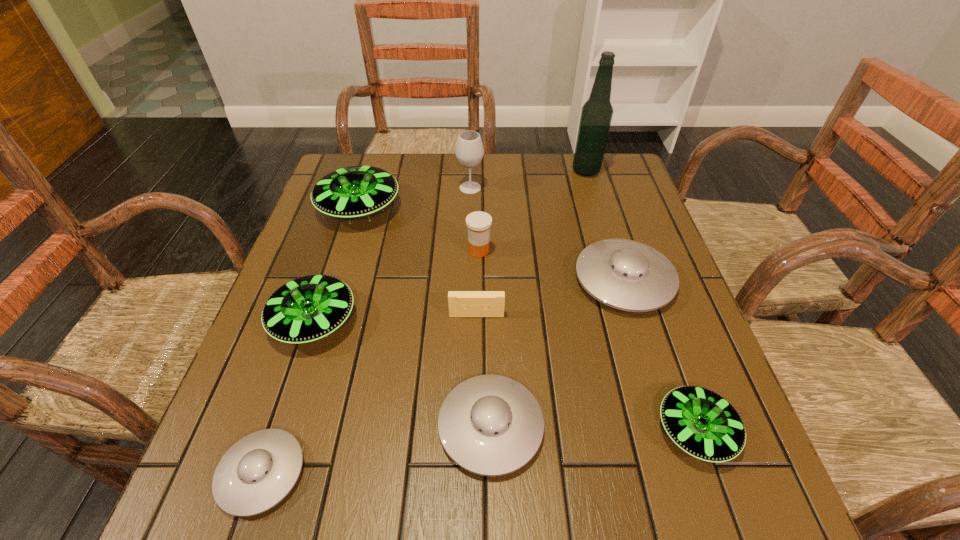
You are a GUI agent. You are given a task and a screenshot of the screen. Output one action in this format:
    pyautogui.click(x=<x>, y=<y>)
    Task: Click on the free area in between the farthest saucer and the second tallest object
    
    Given the screenshot: What is the action you would take?
    pyautogui.click(x=415, y=198)

What are the coordinates of `vacant area between the rightmost green saucer and the second smallest gray saucer` in the screenshot? It's located at (593, 429).

You are a GUI agent. You are given a task and a screenshot of the screen. Output one action in this format:
    pyautogui.click(x=<x>, y=<y>)
    Task: Click on the free space between the shortest saucer and the medicine
    
    Given the screenshot: What is the action you would take?
    (371, 362)

Where is `free space between the rightmost gray saucer and the farthest object`? This screenshot has width=960, height=540. free space between the rightmost gray saucer and the farthest object is located at coordinates (605, 226).

Identify the location of empty space that is in between the farthest gray saucer and the second biggest gray saucer. This screenshot has width=960, height=540. (558, 353).

The height and width of the screenshot is (540, 960). I want to click on the fifth closest object relative to the second biggest green saucer, so click(x=478, y=223).

At what (x,y) coordinates should I click in order to perform the action: click on object identified as the ninth closest to the second gray saucer from left to right. Please return your answer as a coordinate pair (x, y). The image size is (960, 540). Looking at the image, I should click on (596, 115).

The height and width of the screenshot is (540, 960). In order to click on the closest saucer to the second tallest saucer in this screenshot , I will do `click(258, 471)`.

Image resolution: width=960 pixels, height=540 pixels. Identify the location of the fifth closest saucer to the alcohol. (702, 423).

Identify which green saucer is the nearest to the nearest green saucer. Please provide its 2D coordinates. Your answer should be formatted as a tuple, i.e. [(x, y)], where the tuple contains the x and y coordinates of a point satisfying the conditions above.

[(306, 309)]